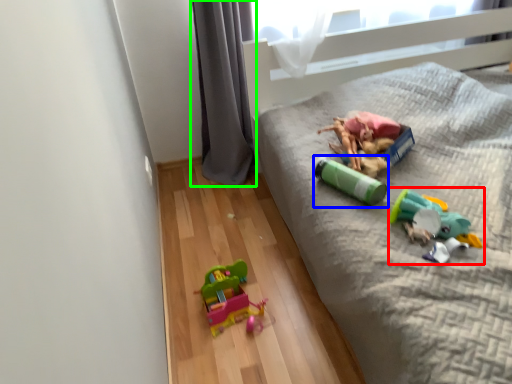
Question: Estimate the real-world distances between objects in this image. Which object is farther from toy (highlighted by a red box), toy (highlighted by a blue box) or curtain (highlighted by a green box)?

Choices:
 (A) toy
 (B) curtain

Answer: (B)